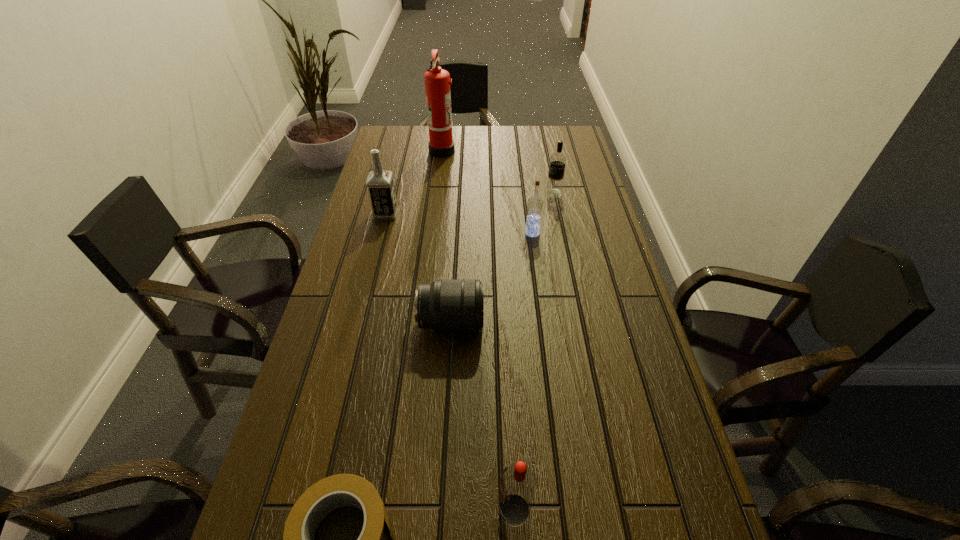
At what (x,y) coordinates should I click in order to perform the action: click on free spot between the sixth tallest object and the second vodka from left to right. Please return your answer as a coordinate pair (x, y). Looking at the image, I should click on (483, 416).

The height and width of the screenshot is (540, 960). I want to click on free space between the third nearest object and the second vodka from left to right, so click(483, 416).

The width and height of the screenshot is (960, 540). In order to click on vacant space that's between the farthest vodka and the fire extinguisher in this screenshot , I will do `click(498, 172)`.

Find the location of a particular element. The height and width of the screenshot is (540, 960). vacant area between the nearest vodka and the third nearest object is located at coordinates (483, 416).

What are the coordinates of `object that stands as the closest to the third farthest object` in the screenshot? It's located at (437, 81).

I want to click on object that ranks as the third closest to the shortest object, so click(534, 204).

Select which vodka is the third closest to the fourth farthest object. Please provide its 2D coordinates. Your answer should be formatted as a tuple, i.e. [(x, y)], where the tuple contains the x and y coordinates of a point satisfying the conditions above.

[(518, 483)]

At what (x,y) coordinates should I click in order to perform the action: click on the closest vodka to the duct tape. Please return your answer as a coordinate pair (x, y). This screenshot has width=960, height=540. Looking at the image, I should click on (518, 483).

You are a GUI agent. You are given a task and a screenshot of the screen. Output one action in this format:
    pyautogui.click(x=<x>, y=<y>)
    Task: Click on the blank space that satisfies the following two spatial constraints: 1. on the front label of the leftmost vodka; 2. on the back side of the second object from right to left
    This screenshot has height=540, width=960.
    Given the screenshot: What is the action you would take?
    pyautogui.click(x=381, y=233)

The height and width of the screenshot is (540, 960). Find the location of `vacant space that satisfies the following two spatial constraints: 1. at the nozzle of the second vodka from right to left; 2. on the right side of the fire extinguisher`. vacant space that satisfies the following two spatial constraints: 1. at the nozzle of the second vodka from right to left; 2. on the right side of the fire extinguisher is located at coordinates (432, 233).